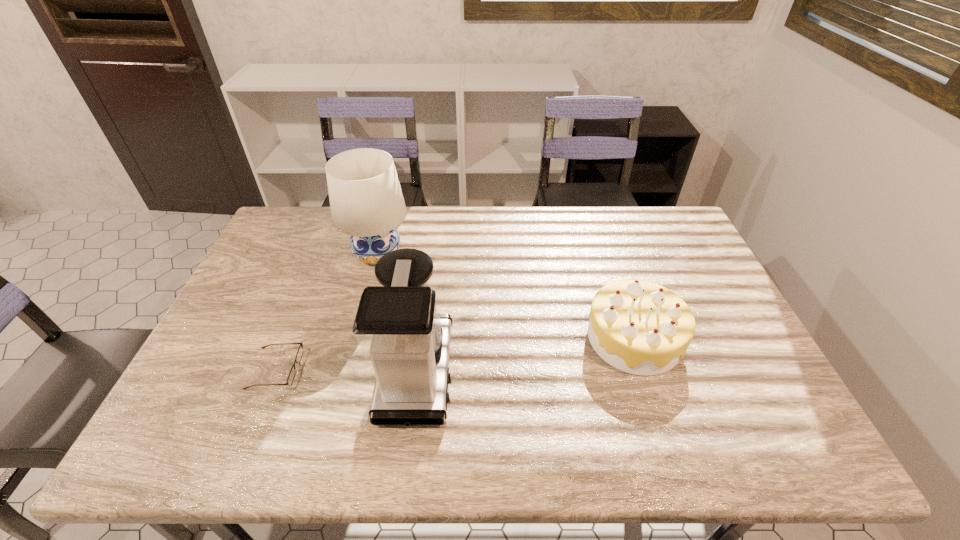
I want to click on unoccupied position between the lampshade and the shortest object, so click(x=326, y=312).

The height and width of the screenshot is (540, 960). Find the location of `free space between the spectacles and the coffee maker`. free space between the spectacles and the coffee maker is located at coordinates (347, 370).

At what (x,y) coordinates should I click in order to perform the action: click on vacant space in between the leftmost object and the lampshade. Please return your answer as a coordinate pair (x, y). This screenshot has height=540, width=960. Looking at the image, I should click on (326, 312).

Where is `vacant area that lies between the spectacles and the coffee maker`? vacant area that lies between the spectacles and the coffee maker is located at coordinates (347, 370).

Locate an element on the screen. blank region between the shortest object and the farthest object is located at coordinates (326, 312).

Identify which object is located as the nearest to the spectacles. Please provide its 2D coordinates. Your answer should be formatted as a tuple, i.e. [(x, y)], where the tuple contains the x and y coordinates of a point satisfying the conditions above.

[(398, 326)]

This screenshot has height=540, width=960. In order to click on object that is the third closest to the lampshade in this screenshot , I will do `click(639, 327)`.

This screenshot has height=540, width=960. I want to click on free space that satisfies the following two spatial constraints: 1. on the front-facing side of the farthest object; 2. on the front-facing side of the leftmost object, so click(x=348, y=369).

This screenshot has height=540, width=960. Find the location of `vacant region that satisfies the following two spatial constraints: 1. on the front-facing side of the lampshade; 2. on the left side of the third tallest object`. vacant region that satisfies the following two spatial constraints: 1. on the front-facing side of the lampshade; 2. on the left side of the third tallest object is located at coordinates (356, 338).

At what (x,y) coordinates should I click in order to perform the action: click on free space that satisfies the following two spatial constraints: 1. on the front side of the second shortest object; 2. on the front-facing side of the shortest object. Please return your answer as a coordinate pair (x, y). The width and height of the screenshot is (960, 540). Looking at the image, I should click on (644, 369).